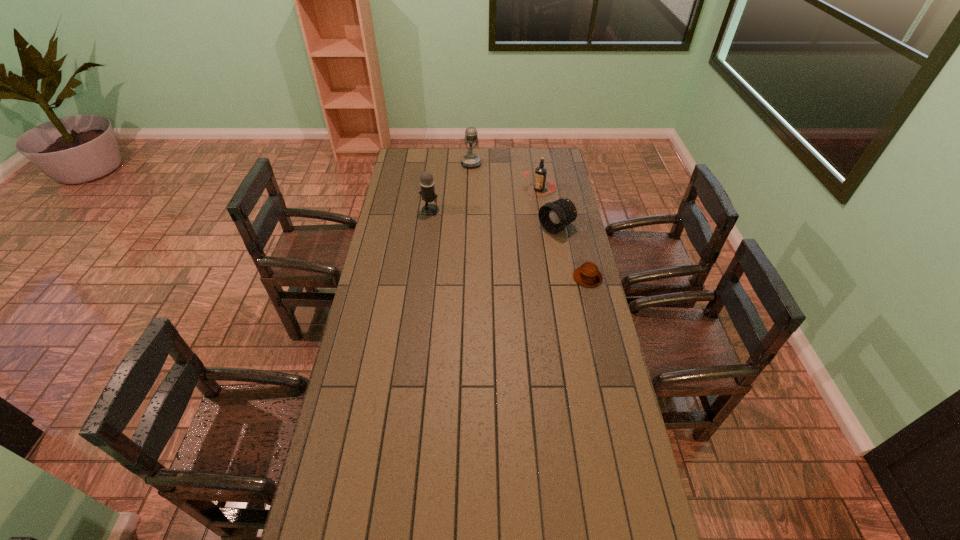
Identify which object is the third closest to the farther microphone. Please provide its 2D coordinates. Your answer should be formatted as a tuple, i.e. [(x, y)], where the tuple contains the x and y coordinates of a point satisfying the conditions above.

[(554, 216)]

Where is `blank area in the image that satisfies the following two spatial constraints: 1. on the back side of the farther microphone; 2. on the left side of the nearer microphone`? blank area in the image that satisfies the following two spatial constraints: 1. on the back side of the farther microphone; 2. on the left side of the nearer microphone is located at coordinates (436, 164).